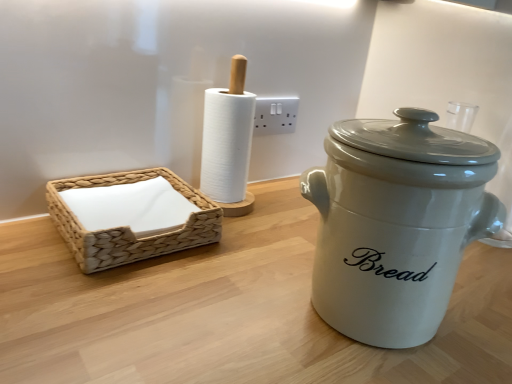
Question: Could you tell me if woven beige basket at left is facing white plastic electric outlet at center?

Choices:
 (A) no
 (B) yes

Answer: (A)

Question: Is white plastic electric outlet at center at the back of woven beige basket at left?

Choices:
 (A) no
 (B) yes

Answer: (A)

Question: Is woven beige basket at left to the left of white plastic electric outlet at center from the viewer's perspective?

Choices:
 (A) yes
 (B) no

Answer: (A)

Question: Considering the relative sizes of woven beige basket at left and white plastic electric outlet at center in the image provided, is woven beige basket at left shorter than white plastic electric outlet at center?

Choices:
 (A) no
 (B) yes

Answer: (B)

Question: Does woven beige basket at left have a smaller size compared to white plastic electric outlet at center?

Choices:
 (A) yes
 (B) no

Answer: (B)

Question: Are woven beige basket at left and white plastic electric outlet at center located far from each other?

Choices:
 (A) no
 (B) yes

Answer: (A)

Question: From a real-world perspective, is white plastic electric outlet at center on woven beige basket at left?

Choices:
 (A) no
 (B) yes

Answer: (B)

Question: From a real-world perspective, is white plastic electric outlet at center positioned under woven beige basket at left based on gravity?

Choices:
 (A) yes
 (B) no

Answer: (B)

Question: Does white plastic electric outlet at center appear on the left side of woven beige basket at left?

Choices:
 (A) no
 (B) yes

Answer: (A)

Question: Is the position of white plastic electric outlet at center more distant than that of woven beige basket at left?

Choices:
 (A) no
 (B) yes

Answer: (B)

Question: Is white plastic electric outlet at center bigger than woven beige basket at left?

Choices:
 (A) yes
 (B) no

Answer: (B)

Question: Are white plastic electric outlet at center and woven beige basket at left making contact?

Choices:
 (A) yes
 (B) no

Answer: (B)

Question: Can you confirm if white plastic electric outlet at center is wider than white ceramic crock pot at right?

Choices:
 (A) no
 (B) yes

Answer: (A)